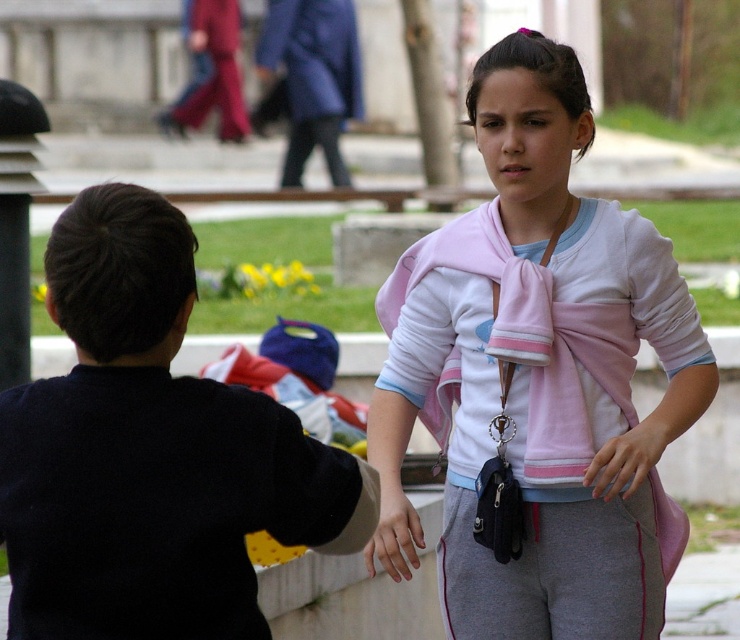
Who is positioned more to the right, pink fabric scarf at center or pink fleece sweatshirt at center?

pink fabric scarf at center is more to the right.

In the scene shown: Who is more forward, [619,625] or [548,368]?

Point [619,625] is more forward.

Locate an element on the screen. This screenshot has width=740, height=640. pink fabric scarf at center is located at coordinates (538, 371).

Is gray cotton leggings at lower center to the left of blue cotton sweatshirt at upper center from the viewer's perspective?

In fact, gray cotton leggings at lower center is to the right of blue cotton sweatshirt at upper center.

Where is `gray cotton leggings at lower center`? This screenshot has width=740, height=640. gray cotton leggings at lower center is located at coordinates (555, 572).

Who is positioned more to the right, pink fleece sweatshirt at center or smooth skin hand at center?

From the viewer's perspective, pink fleece sweatshirt at center appears more on the right side.

Does pink fleece sweatshirt at center have a greater height compared to smooth skin hand at center?

Correct, pink fleece sweatshirt at center is much taller as smooth skin hand at center.

Is point (448, 294) positioned after point (394, 426)?

That is False.

Where is `pink fleece sweatshirt at center`? pink fleece sweatshirt at center is located at coordinates (534, 337).